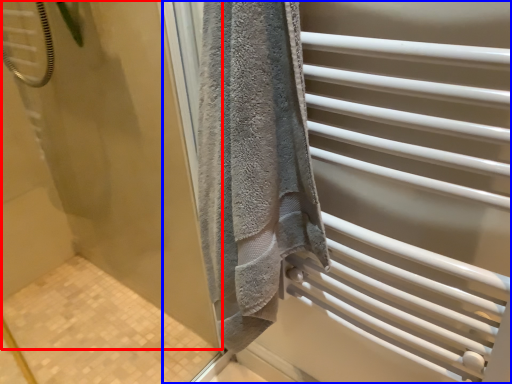
Question: Among these objects, which one is nearest to the camera, screen door (highlighted by a red box) or screen door (highlighted by a blue box)?

Choices:
 (A) screen door
 (B) screen door

Answer: (A)